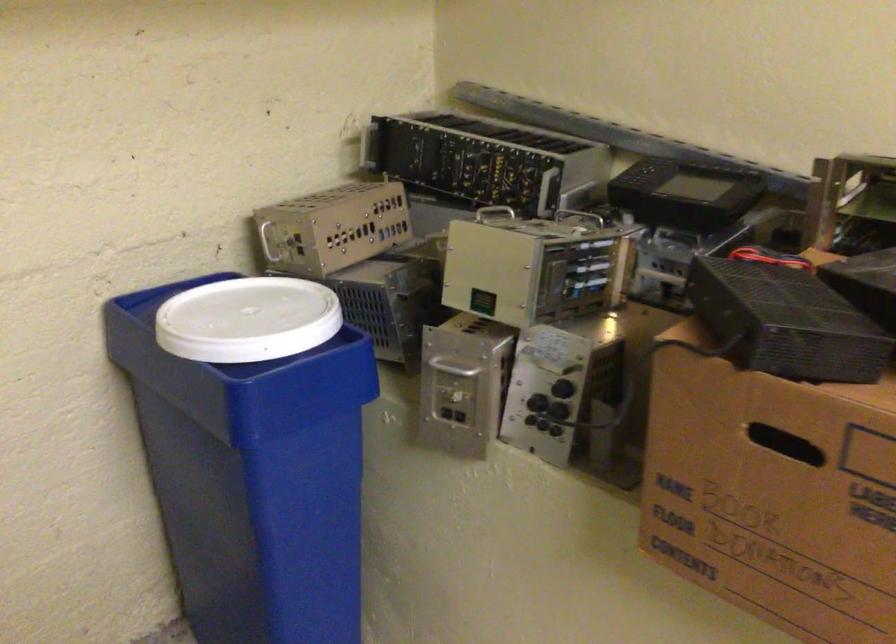
Find the location of a particular element. black electronics box is located at coordinates (786, 322).